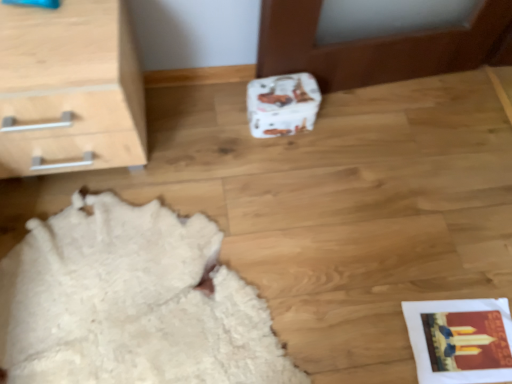
Where is `spots to the right of light wood/texture chest of drawers at upper left`? This screenshot has height=384, width=512. spots to the right of light wood/texture chest of drawers at upper left is located at coordinates (204, 128).